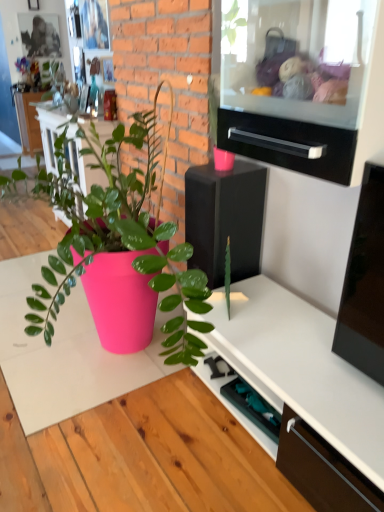
Question: From a real-world perspective, relative to black glossy drawer at upper center, is black glossy speaker at center vertically above or below?

Choices:
 (A) below
 (B) above

Answer: (A)

Question: Is black glossy speaker at center bigger or smaller than black glossy drawer at upper center?

Choices:
 (A) big
 (B) small

Answer: (A)

Question: Considering the positions of black glossy speaker at center and black glossy drawer at upper center in the image, is black glossy speaker at center taller or shorter than black glossy drawer at upper center?

Choices:
 (A) short
 (B) tall

Answer: (B)

Question: Is black glossy drawer at upper center taller or shorter than black glossy speaker at center?

Choices:
 (A) tall
 (B) short

Answer: (B)

Question: Do you think black glossy drawer at upper center is within black glossy speaker at center, or outside of it?

Choices:
 (A) inside
 (B) outside

Answer: (B)

Question: Is black glossy drawer at upper center in front of or behind black glossy speaker at center in the image?

Choices:
 (A) front
 (B) behind

Answer: (A)

Question: From the image's perspective, is black glossy drawer at upper center positioned above or below black glossy speaker at center?

Choices:
 (A) below
 (B) above

Answer: (B)